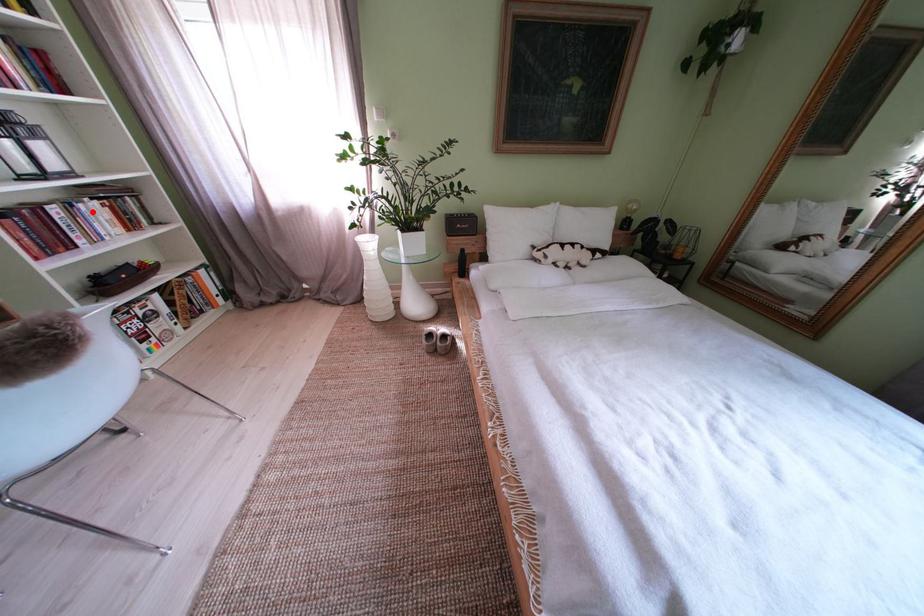
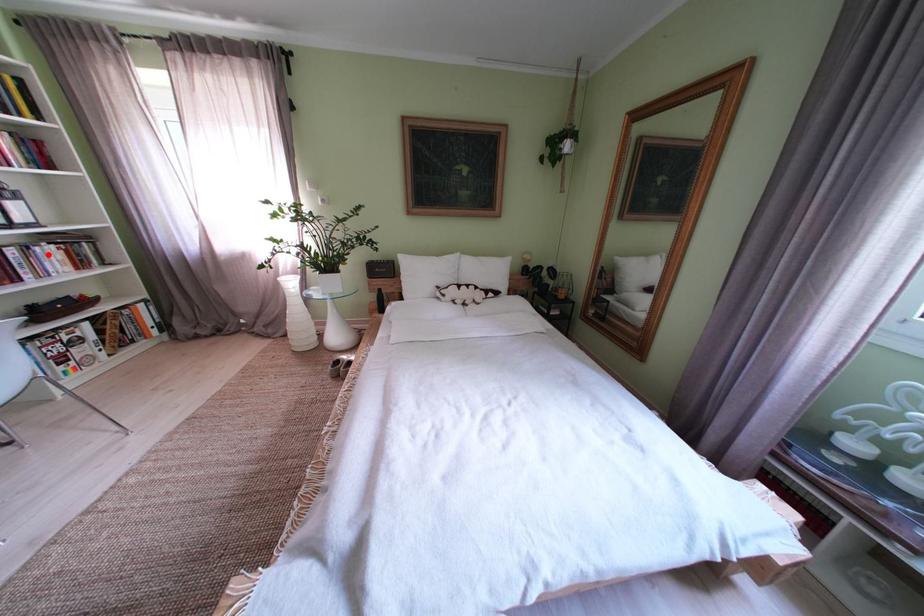
I am providing you with two images of the same scene from different viewpoints. A red point is marked on the first image and another point is marked on the second image. Is the marked point in image1 the same physical position as the marked point in image2?

Yes